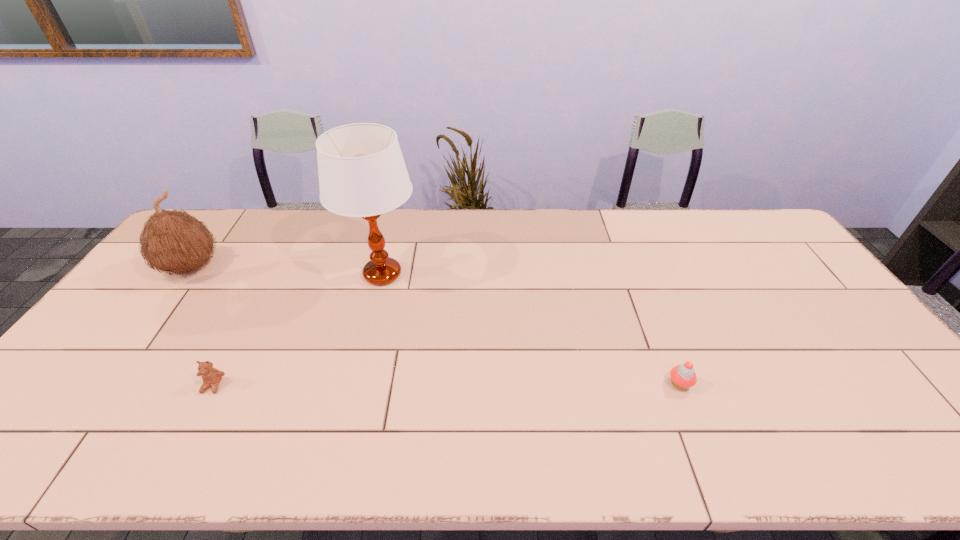
You are a GUI agent. You are given a task and a screenshot of the screen. Output one action in this format:
    pyautogui.click(x=<x>, y=<y>)
    Task: Click on the free area in between the table lamp and the teddy bear
    
    Given the screenshot: What is the action you would take?
    pyautogui.click(x=298, y=330)

Find the location of `free space between the table lamp and the third shortest object`. free space between the table lamp and the third shortest object is located at coordinates (287, 271).

In order to click on free space between the third object from right to left and the coconut in this screenshot , I will do `click(202, 327)`.

Identify the location of free space between the table lamp and the teddy bear. (298, 330).

Where is `free space between the second object from left to right and the rightmost object`? free space between the second object from left to right and the rightmost object is located at coordinates (446, 384).

At what (x,y) coordinates should I click in order to perform the action: click on unoccupied area between the second tallest object and the tallest object. Please return your answer as a coordinate pair (x, y). This screenshot has width=960, height=540. Looking at the image, I should click on (287, 271).

Identify the location of free point between the third object from right to left and the third object from left to right. Image resolution: width=960 pixels, height=540 pixels. coord(298,330).

Where is `free spot between the third object from left to right and the second object from left to right`? Image resolution: width=960 pixels, height=540 pixels. free spot between the third object from left to right and the second object from left to right is located at coordinates (298, 330).

Image resolution: width=960 pixels, height=540 pixels. Identify the location of object that is the closest to the rightmost object. (362, 173).

The width and height of the screenshot is (960, 540). In order to click on object that is the closest to the teddy bear in this screenshot , I will do `click(362, 173)`.